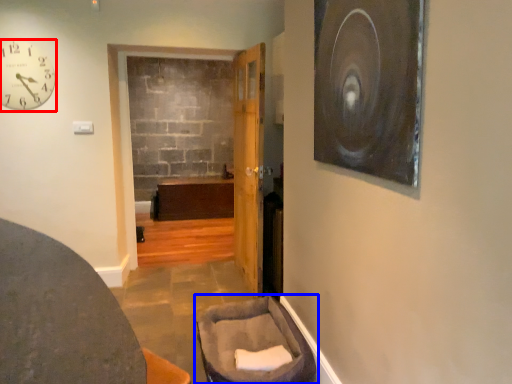
Question: Which of the following is the farthest to the observer, clock (highlighted by a red box) or furniture (highlighted by a blue box)?

Choices:
 (A) clock
 (B) furniture

Answer: (A)